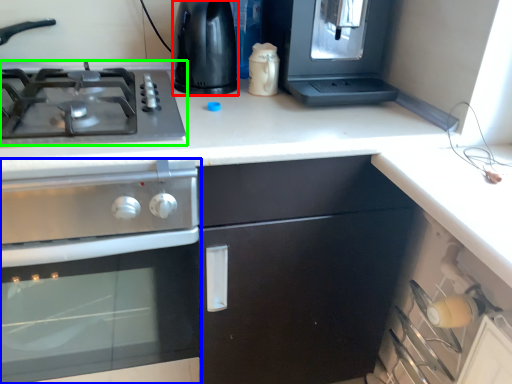
Question: Which object is the farthest from appliance (highlighted by a red box)? Choose among these: kitchen appliance (highlighted by a blue box) or gas stove (highlighted by a green box).

Choices:
 (A) kitchen appliance
 (B) gas stove

Answer: (A)